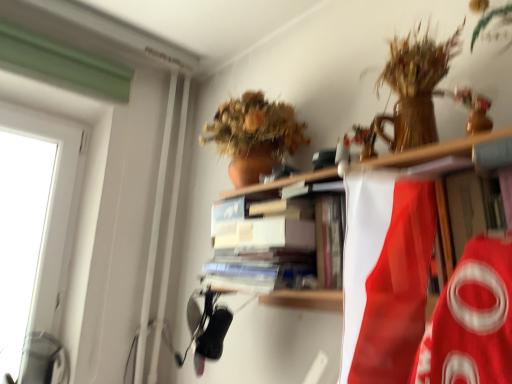
Measure the distance between point [429,148] and camera.

A distance of 29.69 inches exists between point [429,148] and camera.

Locate an element on the screen. The height and width of the screenshot is (384, 512). wooden shelf at upper center is located at coordinates (432, 151).

What do you see at coordinates (432, 151) in the screenshot?
I see `wooden shelf at upper center` at bounding box center [432, 151].

Find the location of a particular element. white cardboard book at center is located at coordinates (258, 250).

This screenshot has width=512, height=384. Describe the element at coordinates (258, 250) in the screenshot. I see `white cardboard book at center` at that location.

Locate an element on the screen. The image size is (512, 384). wooden shelf at upper center is located at coordinates (432, 151).

Is wooden shelf at upper center at the right side of white cardboard book at center?

Yes, wooden shelf at upper center is to the right of white cardboard book at center.

Considering the relative positions of wooden shelf at upper center and white cardboard book at center in the image provided, is wooden shelf at upper center in front of white cardboard book at center?

That is True.

Which is closer, (426,150) or (213,285)?

Point (426,150) is closer to the camera than point (213,285).

From the image's perspective, which one is positioned lower, wooden shelf at upper center or white cardboard book at center?

wooden shelf at upper center is shown below in the image.

From a real-world perspective, is wooden shelf at upper center located beneath white cardboard book at center?

Yes, from a real-world perspective, wooden shelf at upper center is beneath white cardboard book at center.

Is wooden shelf at upper center thinner than white cardboard book at center?

Yes.

Can you confirm if wooden shelf at upper center is taller than white cardboard book at center?

Correct, wooden shelf at upper center is much taller as white cardboard book at center.

Does wooden shelf at upper center have a larger size compared to white cardboard book at center?

Indeed, wooden shelf at upper center has a larger size compared to white cardboard book at center.

Choose the correct answer: Is wooden shelf at upper center inside white cardboard book at center or outside it?

wooden shelf at upper center is not enclosed by white cardboard book at center.

Is wooden shelf at upper center not close to white cardboard book at center?

No, there isn't a large distance between wooden shelf at upper center and white cardboard book at center.

Is wooden shelf at upper center positioned with its back to white cardboard book at center?

That's right, wooden shelf at upper center is facing away from white cardboard book at center.

How many degrees apart are the facing directions of wooden shelf at upper center and white cardboard book at center?

The angular difference between wooden shelf at upper center and white cardboard book at center is 0.277 degrees.

How far apart are wooden shelf at upper center and white cardboard book at center?

The distance of wooden shelf at upper center from white cardboard book at center is 6.64 inches.

Where is `book behind the wooden shelf at upper center`? book behind the wooden shelf at upper center is located at coordinates (258, 250).

Between white cardboard book at center and wooden shelf at upper center, which one appears on the right side from the viewer's perspective?

Positioned to the right is wooden shelf at upper center.

Which is behind, white cardboard book at center or wooden shelf at upper center?

white cardboard book at center is further from the camera.

Between point (280, 277) and point (326, 169), which one is positioned in front?

Positioned in front is point (280, 277).

From the image's perspective, is white cardboard book at center on wooden shelf at upper center?

Yes.

From a real-world perspective, which is physically above, white cardboard book at center or wooden shelf at upper center?

In real-world perspective, white cardboard book at center is above.

Does white cardboard book at center have a greater width compared to wooden shelf at upper center?

Yes, white cardboard book at center is wider than wooden shelf at upper center.

Does white cardboard book at center have a lesser height compared to wooden shelf at upper center?

Correct, white cardboard book at center is not as tall as wooden shelf at upper center.

Considering the sizes of objects white cardboard book at center and wooden shelf at upper center in the image provided, who is smaller, white cardboard book at center or wooden shelf at upper center?

white cardboard book at center.

Does white cardboard book at center contain wooden shelf at upper center?

Definitely not — wooden shelf at upper center is not inside white cardboard book at center.

Is white cardboard book at center with wooden shelf at upper center?

No.

Is white cardboard book at center facing away from wooden shelf at upper center?

Yes, white cardboard book at center is facing away from wooden shelf at upper center.

Measure the distance from white cardboard book at center to wooden shelf at upper center.

The distance of white cardboard book at center from wooden shelf at upper center is 6.64 inches.

The image size is (512, 384). In order to click on book above the wooden shelf at upper center (from a real-world perspective) in this screenshot , I will do `click(258, 250)`.

What are the coordinates of `book that appears above the wooden shelf at upper center (from the image's perspective)` in the screenshot? It's located at (258, 250).

Identify the location of book located behind the wooden shelf at upper center. The height and width of the screenshot is (384, 512). (258, 250).